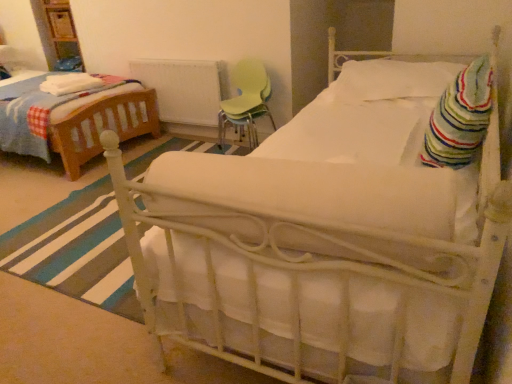
Question: From a real-world perspective, is striped cotton blanket at right, which is the 1th blanket in bottom-to-top order, below white soft blanket at left, which is the second blanket from front to back?

Choices:
 (A) no
 (B) yes

Answer: (A)

Question: Is striped cotton blanket at right, the 2th blanket from the left, shorter than white soft blanket at left, arranged as the second blanket when ordered from the bottom?

Choices:
 (A) no
 (B) yes

Answer: (A)

Question: Is striped cotton blanket at right, the 2th blanket in the back-to-front sequence, bigger than white soft blanket at left, arranged as the second blanket when ordered from the bottom?

Choices:
 (A) no
 (B) yes

Answer: (B)

Question: Considering the relative sizes of striped cotton blanket at right, which is the 1th blanket in bottom-to-top order, and white soft blanket at left, marked as the 1th blanket in a left-to-right arrangement, in the image provided, is striped cotton blanket at right, which is the 1th blanket in bottom-to-top order, thinner than white soft blanket at left, marked as the 1th blanket in a left-to-right arrangement,?

Choices:
 (A) no
 (B) yes

Answer: (B)

Question: From a real-world perspective, is striped cotton blanket at right, which is the 1th blanket in bottom-to-top order, positioned over white soft blanket at left, positioned as the first blanket in top-to-bottom order, based on gravity?

Choices:
 (A) no
 (B) yes

Answer: (B)

Question: Is point (74, 273) closer or farther from the camera than point (226, 91)?

Choices:
 (A) farther
 (B) closer

Answer: (B)

Question: In the image, is white fabric bed at center positioned in front of or behind white painted metal radiator at center?

Choices:
 (A) front
 (B) behind

Answer: (A)

Question: Is white fabric bed at center spatially inside white painted metal radiator at center, or outside of it?

Choices:
 (A) inside
 (B) outside

Answer: (B)

Question: In the image, is white fabric bed at center on the left side or the right side of white painted metal radiator at center?

Choices:
 (A) right
 (B) left

Answer: (A)

Question: Is point (261, 105) positioned closer to the camera than point (366, 99)?

Choices:
 (A) farther
 (B) closer

Answer: (A)

Question: From the image's perspective, relative to white soft pillow at upper right, is green plastic chair at center above or below?

Choices:
 (A) above
 (B) below

Answer: (B)

Question: From a real-world perspective, is green plastic chair at center above or below white soft pillow at upper right?

Choices:
 (A) above
 (B) below

Answer: (B)

Question: Would you say green plastic chair at center is inside or outside white soft pillow at upper right?

Choices:
 (A) outside
 (B) inside

Answer: (A)

Question: In the image, is white soft blanket at left, marked as the 1th blanket in a left-to-right arrangement, on the left side or the right side of green plastic chair at center?

Choices:
 (A) left
 (B) right

Answer: (A)

Question: Looking at the image, does white soft blanket at left, marked as the 1th blanket in a left-to-right arrangement, seem bigger or smaller compared to green plastic chair at center?

Choices:
 (A) big
 (B) small

Answer: (B)